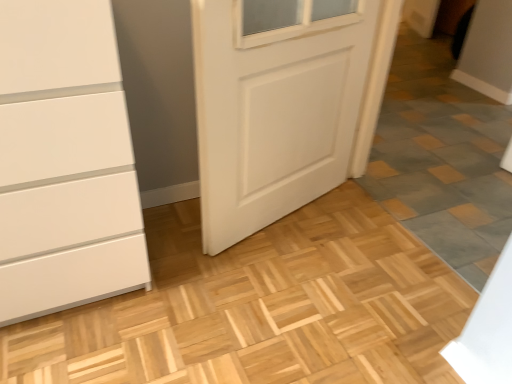
Question: Considering the positions of gray stone tile at lower right and white matte door at center in the image, is gray stone tile at lower right wider or thinner than white matte door at center?

Choices:
 (A) thin
 (B) wide

Answer: (A)

Question: Visually, is gray stone tile at lower right positioned to the left or to the right of white matte door at center?

Choices:
 (A) right
 (B) left

Answer: (A)

Question: From the image's perspective, relative to white matte door at center, is gray stone tile at lower right above or below?

Choices:
 (A) below
 (B) above

Answer: (A)

Question: In the image, is white matte door at center positioned in front of or behind gray stone tile at lower right?

Choices:
 (A) front
 (B) behind

Answer: (B)

Question: Looking at the image, does white matte door at center seem bigger or smaller compared to gray stone tile at lower right?

Choices:
 (A) big
 (B) small

Answer: (A)

Question: Visually, is white matte door at center positioned to the left or to the right of gray stone tile at lower right?

Choices:
 (A) right
 (B) left

Answer: (B)

Question: From a real-world perspective, relative to gray stone tile at lower right, is white matte door at center vertically above or below?

Choices:
 (A) below
 (B) above

Answer: (A)